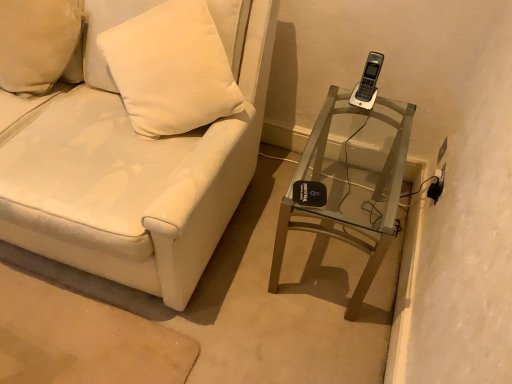
Question: From the image's perspective, is white matte pillow at upper left positioned above or below clear glass table at right?

Choices:
 (A) below
 (B) above

Answer: (B)

Question: In terms of size, does white matte pillow at upper left appear bigger or smaller than clear glass table at right?

Choices:
 (A) small
 (B) big

Answer: (A)

Question: Based on their relative distances, which object is nearer to the clear glass table at right?

Choices:
 (A) white matte pillow at upper left
 (B) white leather couch at center

Answer: (B)

Question: Estimate the real-world distances between objects in this image. Which object is closer to the clear glass table at right?

Choices:
 (A) white matte pillow at upper left
 (B) white leather couch at center

Answer: (B)